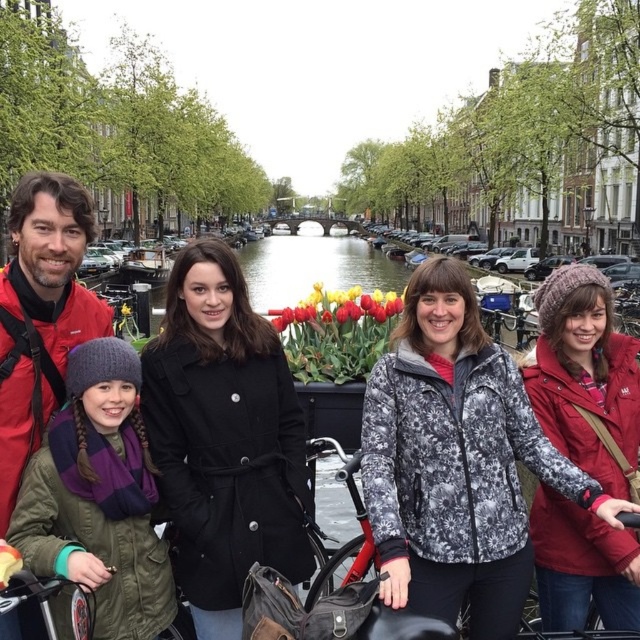
Question: Which object is farther from the camera taking this photo?

Choices:
 (A) red matte bicycle at center
 (B) black matte coat at center
 (C) red fleece jacket at lower right

Answer: (A)

Question: Which of the following is the farthest from the observer?

Choices:
 (A) floral-patterned jacket at center
 (B) matte black coat at center

Answer: (A)

Question: Is the position of floral-patterned jacket at center more distant than that of red fleece jacket at lower right?

Choices:
 (A) no
 (B) yes

Answer: (A)

Question: Is black matte coat at center positioned before red matte bicycle at center?

Choices:
 (A) no
 (B) yes

Answer: (B)

Question: Which of the following is the farthest from the observer?

Choices:
 (A) (598, 554)
 (B) (204, 259)

Answer: (B)

Question: Does black matte coat at center appear on the right side of red fleece jacket at lower right?

Choices:
 (A) yes
 (B) no

Answer: (B)